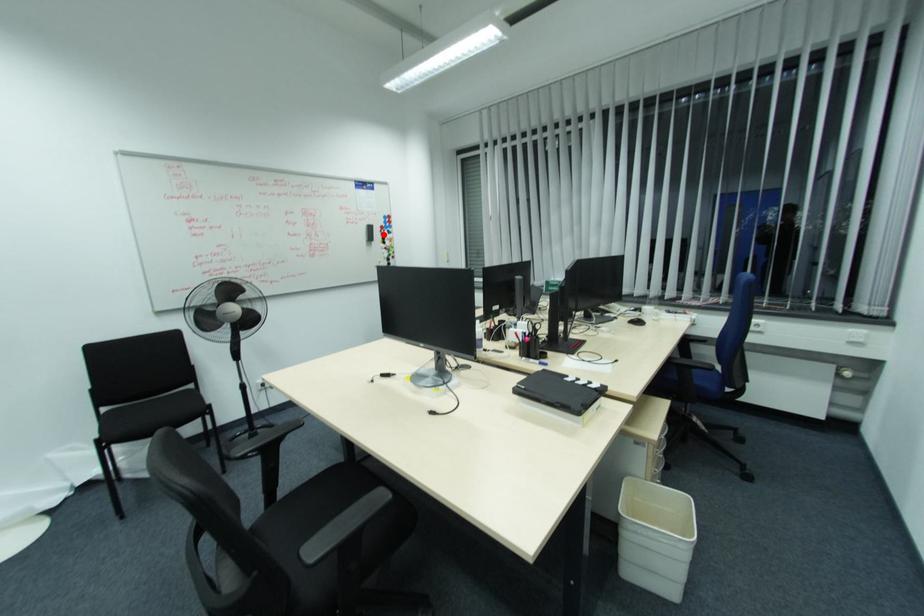
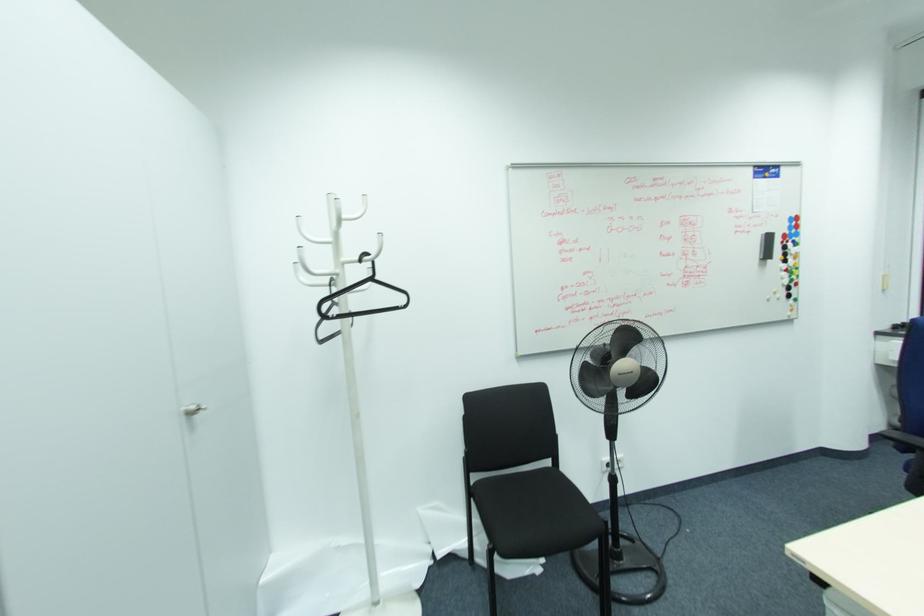
Question: A red point is marked in image1. In image2, is the corresponding 3D point closer to the camera or farther? Reply with the corresponding letter.

Choices:
 (A) The corresponding 3D point is closer.
 (B) The corresponding 3D point is farther.

Answer: (B)